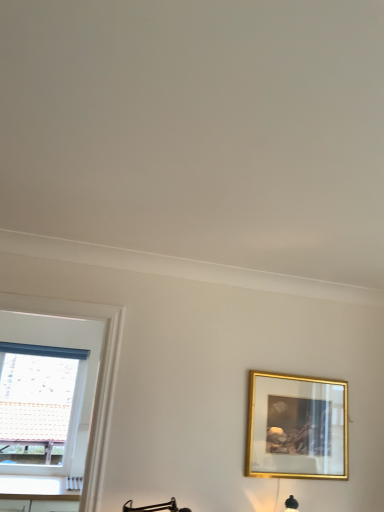
Question: Considering the positions of white plastic window at left and gold metallic picture frame at right in the image, is white plastic window at left bigger or smaller than gold metallic picture frame at right?

Choices:
 (A) big
 (B) small

Answer: (A)

Question: Considering the positions of white plastic window at left and gold metallic picture frame at right in the image, is white plastic window at left wider or thinner than gold metallic picture frame at right?

Choices:
 (A) thin
 (B) wide

Answer: (B)

Question: In the image, is white plastic window at left positioned in front of or behind gold metallic picture frame at right?

Choices:
 (A) behind
 (B) front

Answer: (A)

Question: Is gold metallic picture frame at right bigger or smaller than white plastic window at left?

Choices:
 (A) small
 (B) big

Answer: (A)

Question: In terms of height, does gold metallic picture frame at right look taller or shorter compared to white plastic window at left?

Choices:
 (A) tall
 (B) short

Answer: (B)

Question: In the image, is gold metallic picture frame at right positioned in front of or behind white plastic window at left?

Choices:
 (A) front
 (B) behind

Answer: (A)

Question: Is gold metallic picture frame at right wider or thinner than white plastic window at left?

Choices:
 (A) thin
 (B) wide

Answer: (A)